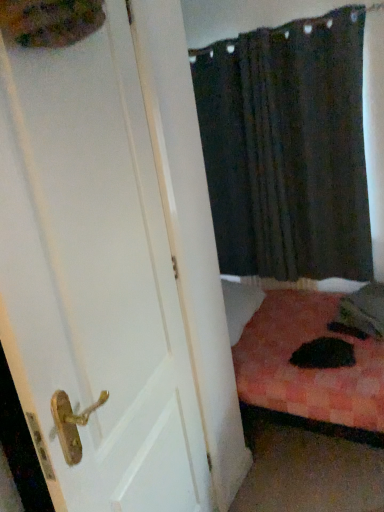
Question: From their relative heights in the image, would you say white wooden door at left is taller or shorter than black fabric curtain at upper right?

Choices:
 (A) tall
 (B) short

Answer: (A)

Question: From the image's perspective, is white wooden door at left positioned above or below black fabric curtain at upper right?

Choices:
 (A) below
 (B) above

Answer: (A)

Question: Relative to black fabric curtain at upper right, is white wooden door at left in front or behind?

Choices:
 (A) behind
 (B) front

Answer: (B)

Question: In terms of width, does black fabric curtain at upper right look wider or thinner when compared to white wooden door at left?

Choices:
 (A) wide
 (B) thin

Answer: (A)

Question: Would you say black fabric curtain at upper right is to the left or to the right of white wooden door at left in the picture?

Choices:
 (A) right
 (B) left

Answer: (A)

Question: From a real-world perspective, relative to white wooden door at left, is black fabric curtain at upper right vertically above or below?

Choices:
 (A) above
 (B) below

Answer: (A)

Question: In the image, is black fabric curtain at upper right positioned in front of or behind white wooden door at left?

Choices:
 (A) behind
 (B) front

Answer: (A)